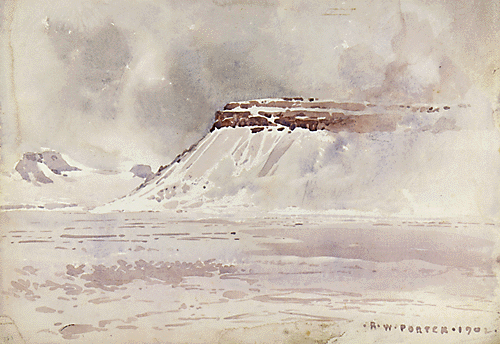
Where is `art`? The height and width of the screenshot is (344, 500). art is located at coordinates (x=384, y=269).